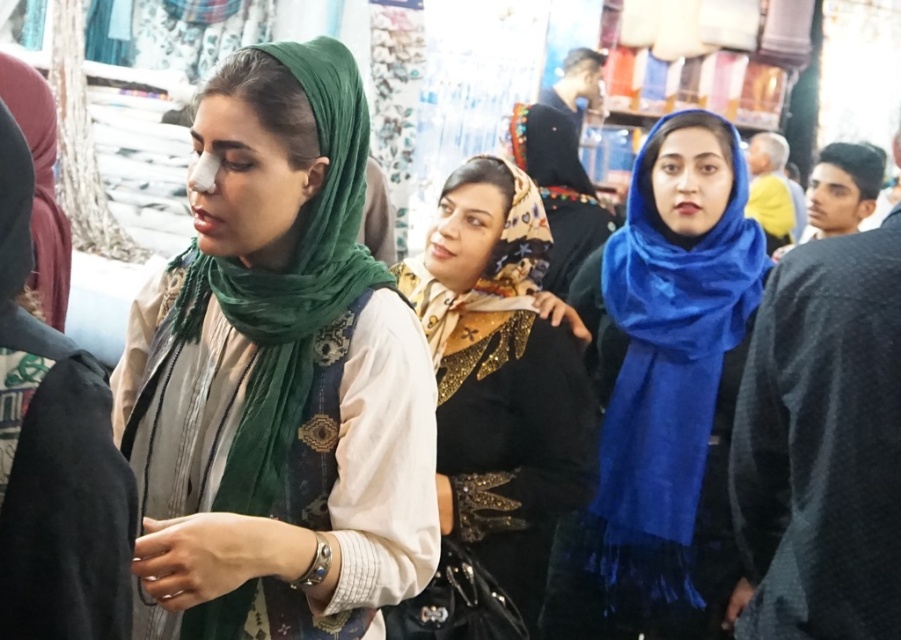
Is the position of green silk scarf at center less distant than that of shiny gold dress at center?

Yes.

Between green silk scarf at center and shiny gold dress at center, which one has more height?

Standing taller between the two is shiny gold dress at center.

Identify the location of green silk scarf at center. This screenshot has width=901, height=640. (281, 378).

Is point (169, 570) closer to camera compared to point (647, 186)?

Yes, it is.

Between green silk scarf at center and blue silk scarf at center, which one appears on the left side from the viewer's perspective?

From the viewer's perspective, green silk scarf at center appears more on the left side.

Is point (215, 477) positioned in front of point (642, 424)?

Yes.

Find the location of `green silk scarf at center`. green silk scarf at center is located at coordinates (281, 378).

Does shiny gold dress at center have a lesser width compared to blue silk scarf at center?

No.

Which is more to the left, shiny gold dress at center or blue silk scarf at center?

shiny gold dress at center is more to the left.

Is point (452, 282) more distant than point (645, 481)?

That is False.

Where is `shiny gold dress at center`? The image size is (901, 640). shiny gold dress at center is located at coordinates (501, 376).